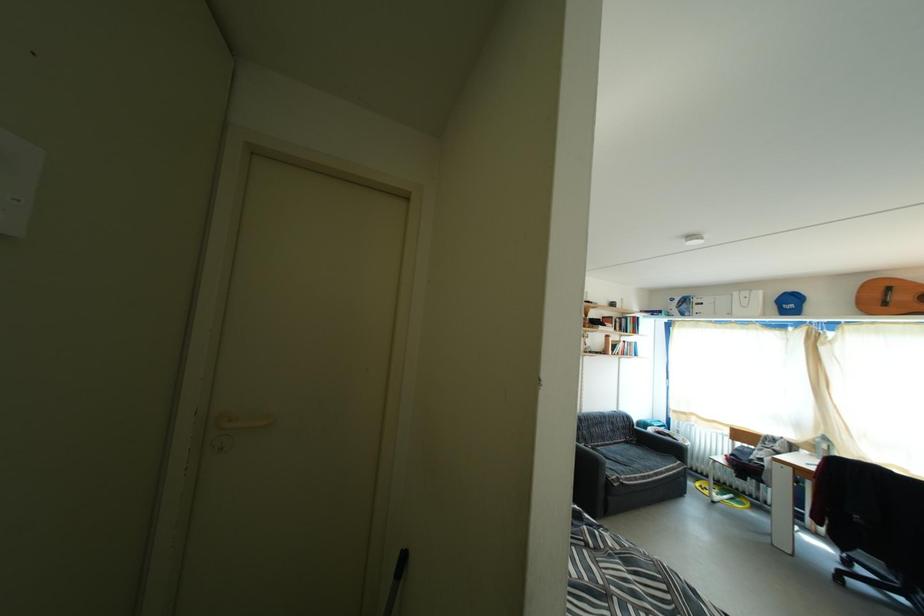
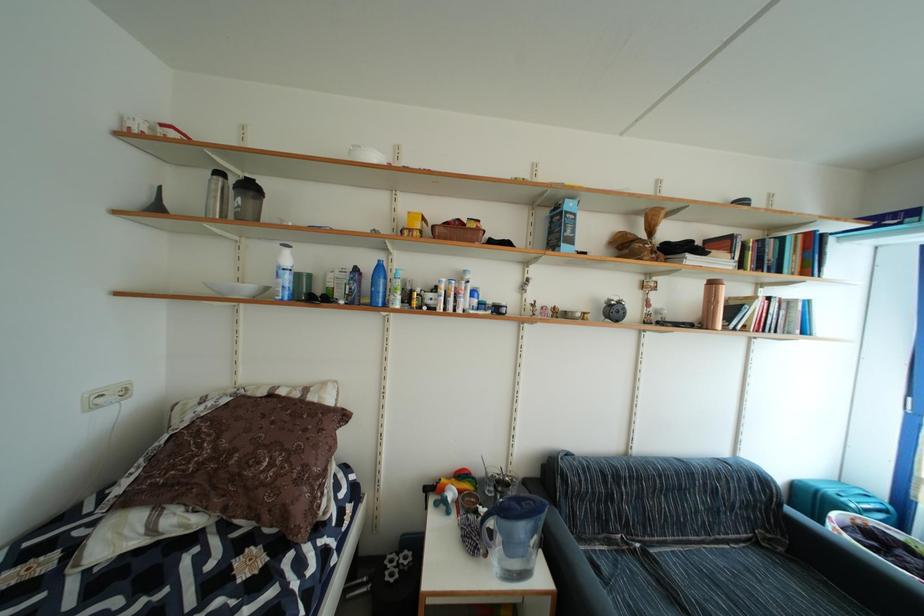
In a continuous first-person perspective shot, in which direction is the camera moving?

The cameraman walked toward right, forward.